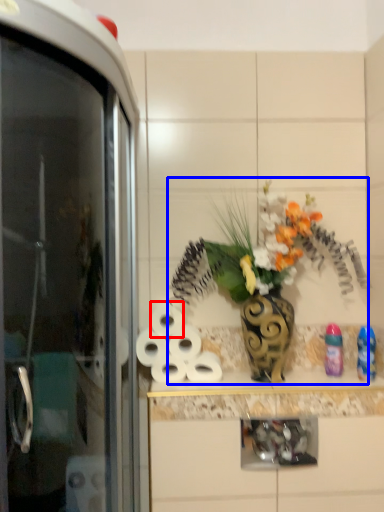
Question: Which of the following is the closest to the observer, toilet paper (highlighted by a red box) or floral arrangement (highlighted by a blue box)?

Choices:
 (A) toilet paper
 (B) floral arrangement

Answer: (B)